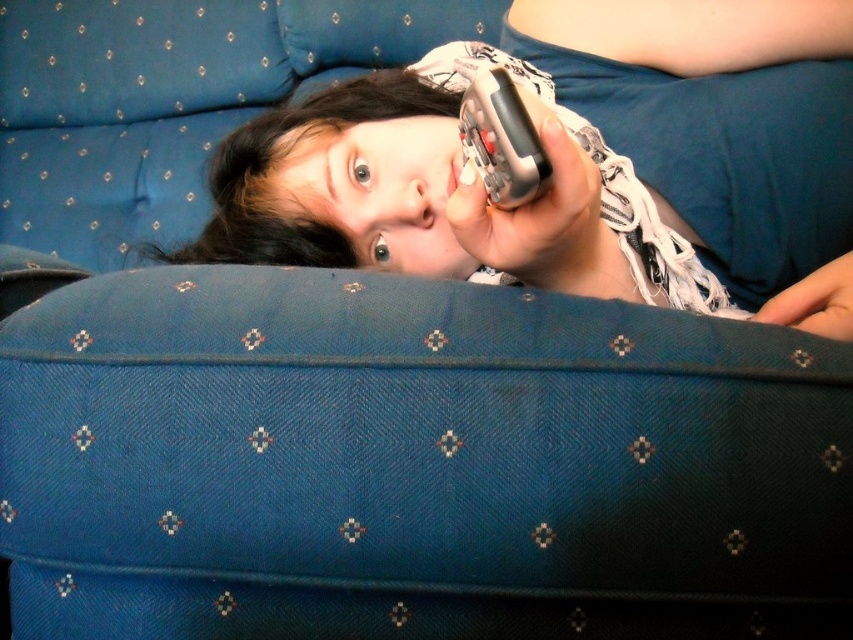
You are a delivery robot that needs to place a small package between the matte plastic remote at center and the metallic silver phone at upper center. The package is 8 inches long. Can you fit it between them?

The matte plastic remote at center and metallic silver phone at upper center are 7.48 inches apart from each other. Since the package is 8 inches long, it cannot fit between them as the distance is shorter than the package length.

Based on the photo, you are a delivery robot entering the living room and need to place a package on the surface where the matte plastic remote at center and metallic silver phone at upper center are located. Which object is closer to you so you can place the package in front of it?

The matte plastic remote at center is closer to you than the metallic silver phone at upper center, so you can place the package in front of the matte plastic remote at center.